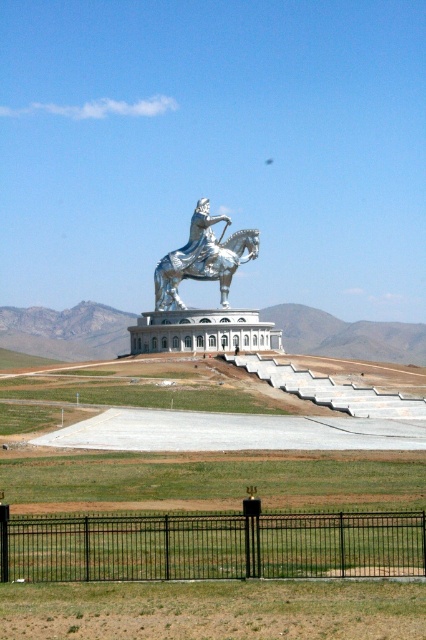
Question: Which is farther from the silver metallic horse at center?

Choices:
 (A) shiny silver statue at center
 (B) black metal fence at lower center

Answer: (B)

Question: Is shiny silver statue at center thinner than silver metallic horse at center?

Choices:
 (A) yes
 (B) no

Answer: (B)

Question: Does black metal fence at lower center appear under silver metallic horse at center?

Choices:
 (A) yes
 (B) no

Answer: (A)

Question: Can you confirm if black metal fence at lower center is wider than shiny silver statue at center?

Choices:
 (A) no
 (B) yes

Answer: (A)

Question: Which point is closer to the camera?

Choices:
 (A) (221, 246)
 (B) (16, 572)
 (C) (253, 243)

Answer: (B)

Question: Considering the real-world distances, which object is closest to the shiny silver statue at center?

Choices:
 (A) silver metallic horse at center
 (B) black metal fence at lower center

Answer: (A)